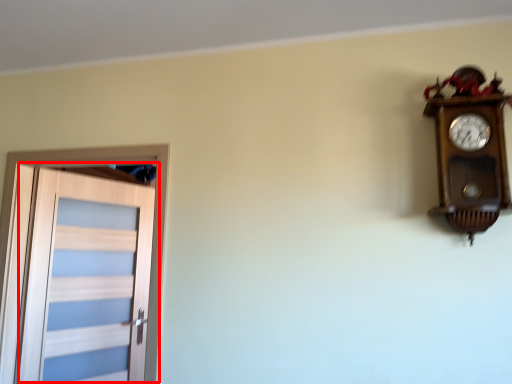
Question: From the image's perspective, what is the correct spatial positioning of door (annotated by the red box) in reference to wall clock?

Choices:
 (A) below
 (B) above

Answer: (A)